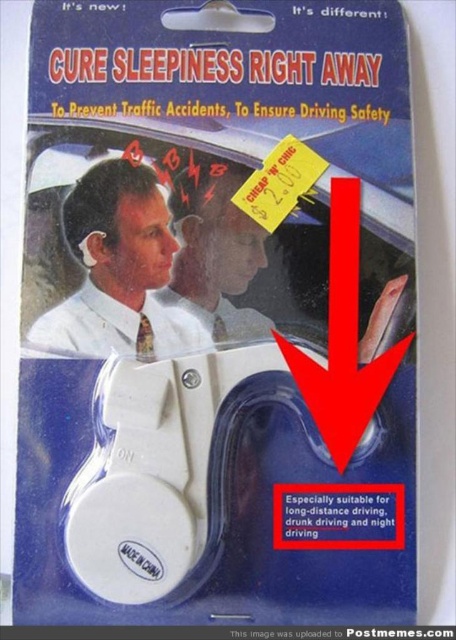
Which is above, white matte tie at upper center or matte white headband at upper center?

matte white headband at upper center is higher up.

Is point (157, 202) behind point (212, 304)?

That is False.

This screenshot has width=456, height=640. What are the coordinates of `white matte tie at upper center` in the screenshot? It's located at (119, 269).